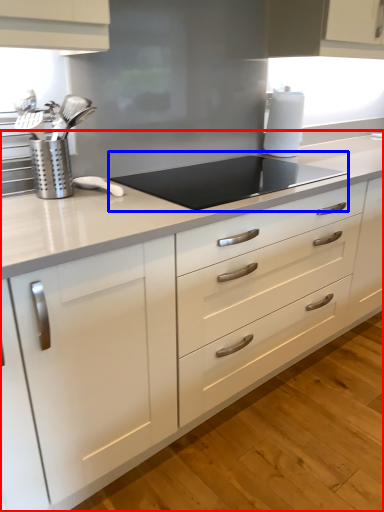
Question: Which object is closer to the camera taking this photo, countertop (highlighted by a red box) or gas stove (highlighted by a blue box)?

Choices:
 (A) countertop
 (B) gas stove

Answer: (A)